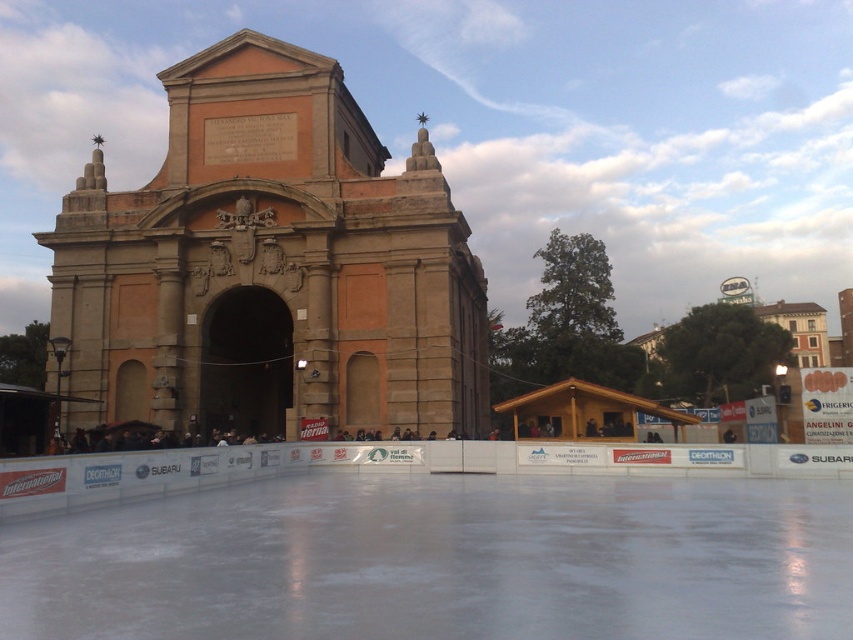
Between brown stone church at center and white smooth ice at center, which one is positioned lower?

white smooth ice at center is below.

Does point (479, 288) come behind point (824, 563)?

That is True.

Identify the location of brown stone church at center. The image size is (853, 640). (270, 266).